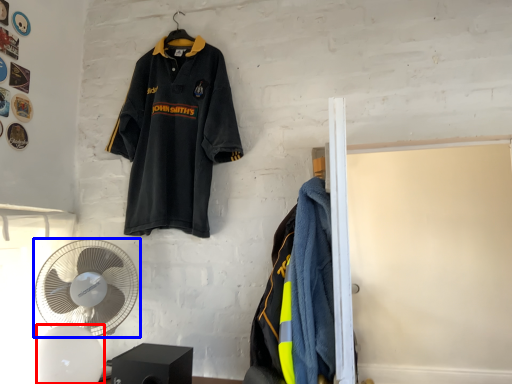
Question: Which object is closer to the camera taking this photo, mechanical fan (highlighted by a red box) or mechanical fan (highlighted by a blue box)?

Choices:
 (A) mechanical fan
 (B) mechanical fan

Answer: (A)